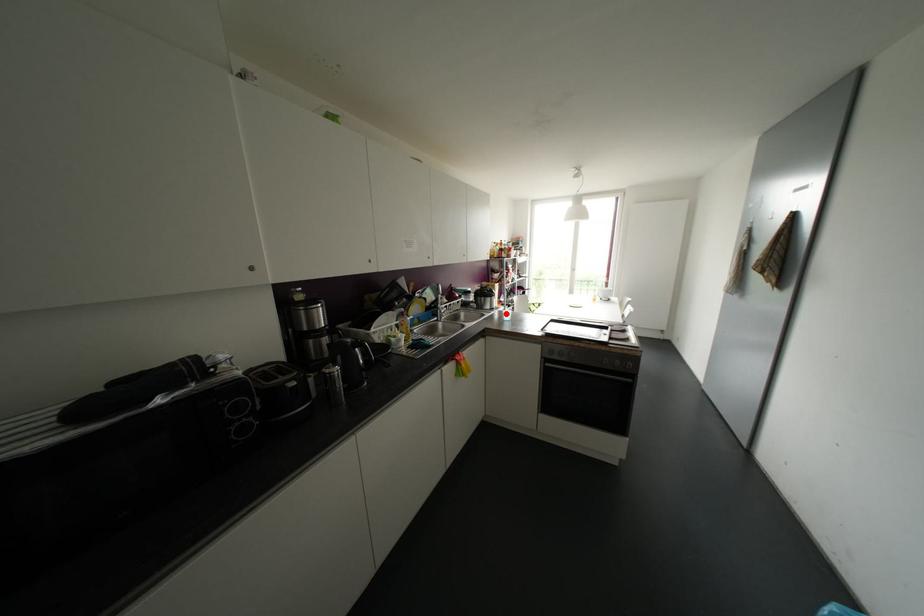
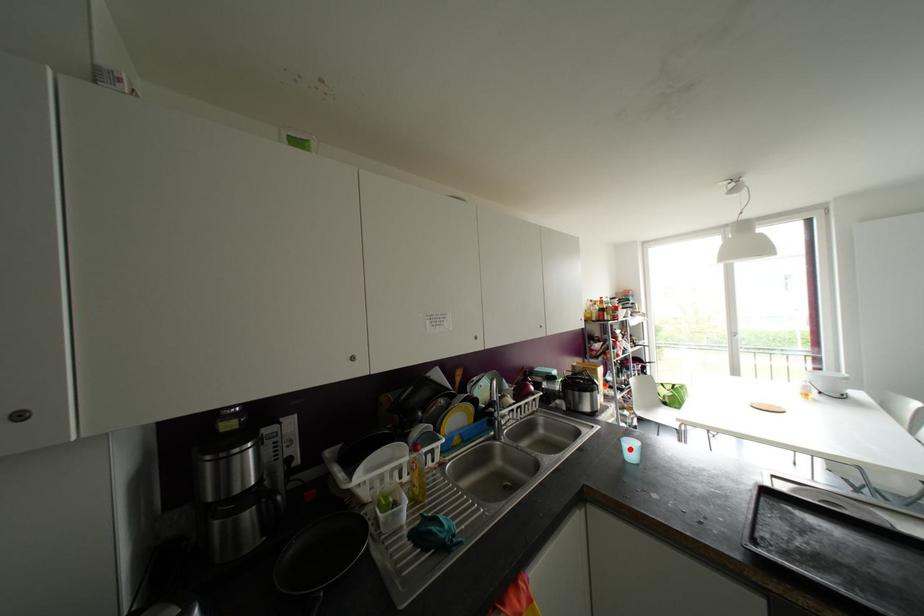
I am providing you with two images of the same scene from different viewpoints. A red point is marked on the first image and another point is marked on the second image. Is the red point in image1 aligned with the point shown in image2?

Yes